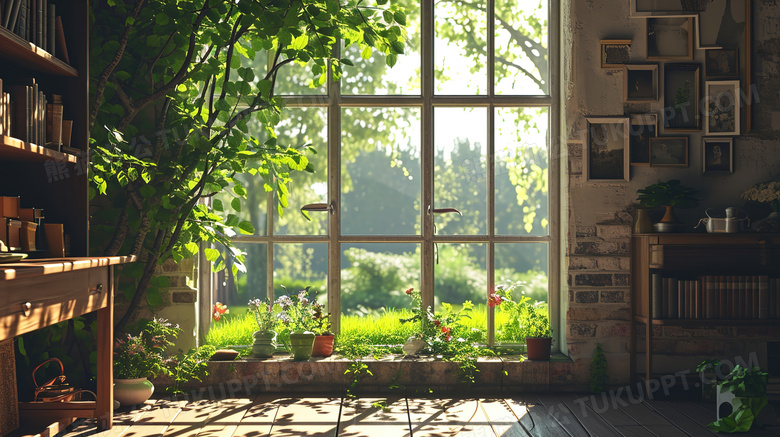
Image resolution: width=780 pixels, height=437 pixels. In order to click on flower pot in this screenshot , I will do `click(534, 347)`, `click(330, 342)`, `click(303, 342)`, `click(263, 343)`, `click(140, 388)`, `click(664, 215)`, `click(760, 207)`, `click(728, 405)`.